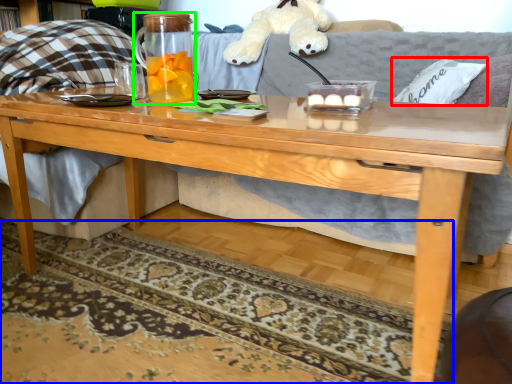
Question: Considering the real-world distances, which object is closest to pillow (highlighted by a red box)? mat (highlighted by a blue box) or beverage (highlighted by a green box).

Choices:
 (A) mat
 (B) beverage

Answer: (B)